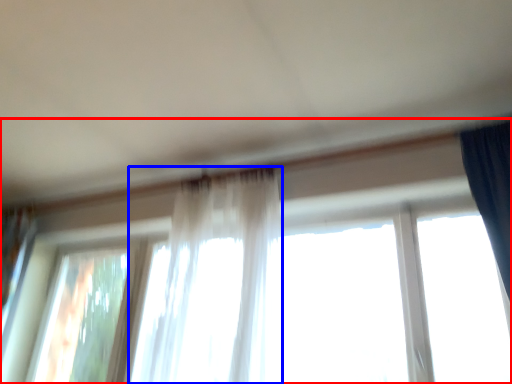
Question: Which of the following is the closest to the observer, window (highlighted by a red box) or curtain (highlighted by a blue box)?

Choices:
 (A) window
 (B) curtain

Answer: (B)